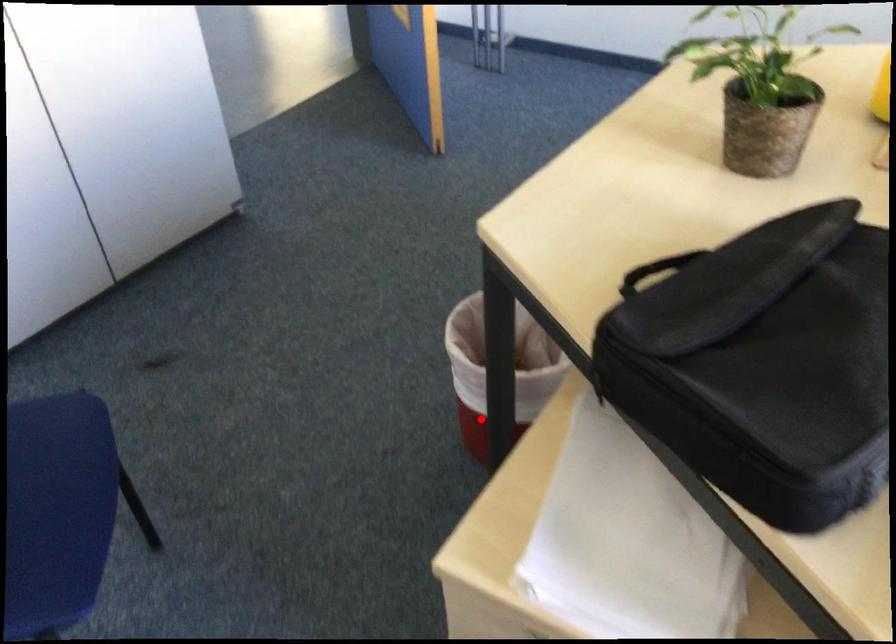
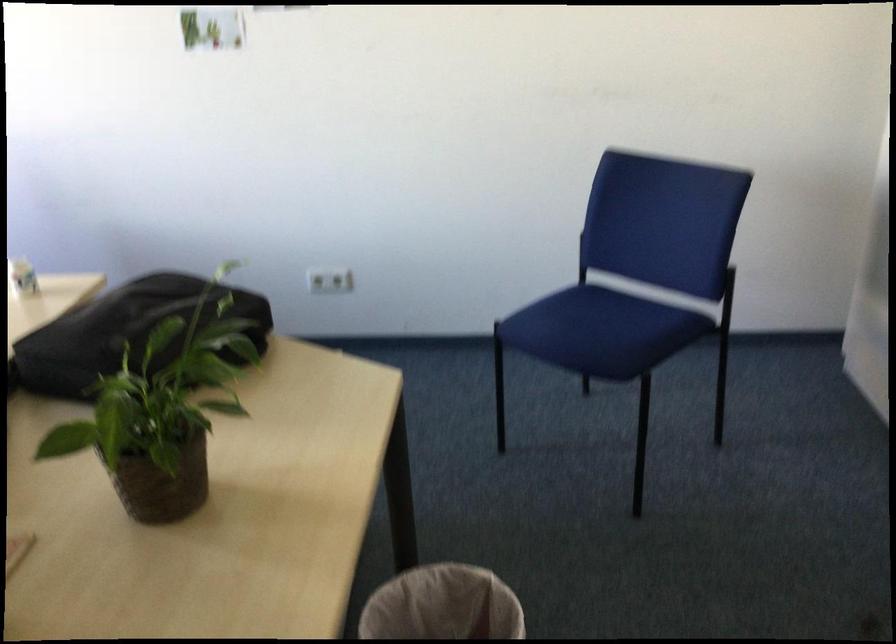
Locate, in the second image, the point that corresponds to the highlighted location in the first image.

(442, 605)